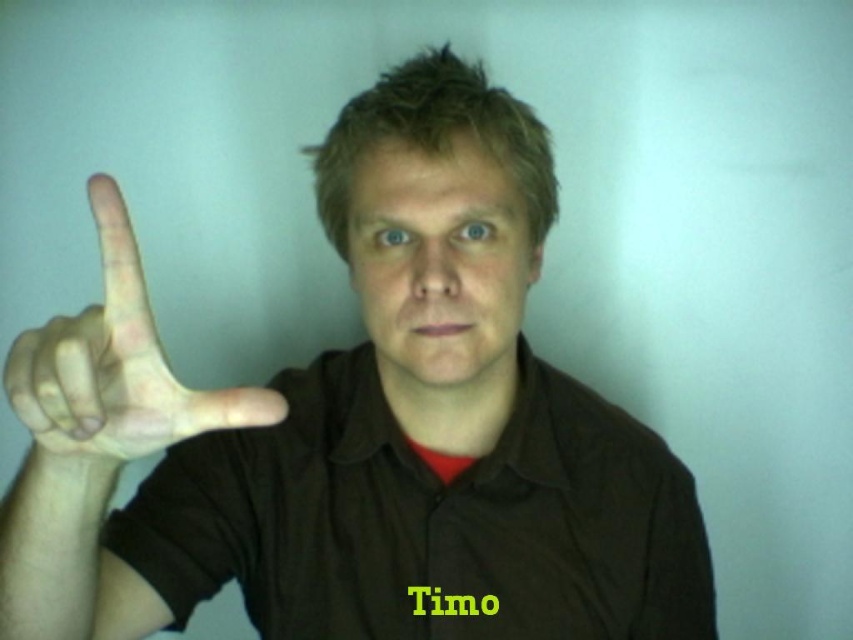
You are a photographer trying to adjust the lighting for a portrait. You notice the brown cotton polo shirt at center and the matte brown face at center in the frame. Which object should you focus on to ensure proper exposure since it occupies more vertical space?

The brown cotton polo shirt at center is taller than the matte brown face at center, so you should focus on the brown cotton polo shirt at center to ensure proper exposure since it occupies more vertical space.